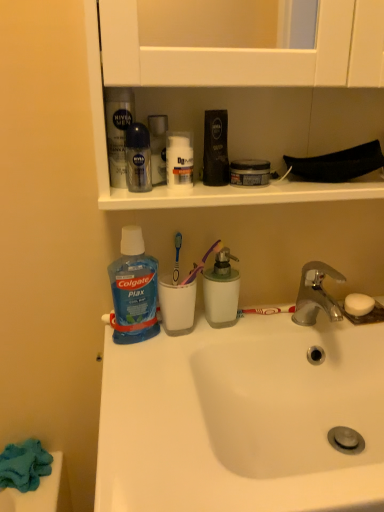
This screenshot has height=512, width=384. I want to click on free location to the right of translucent plastic mouthwash at center, arranged as the third mouthwash when viewed from the left, so (278, 325).